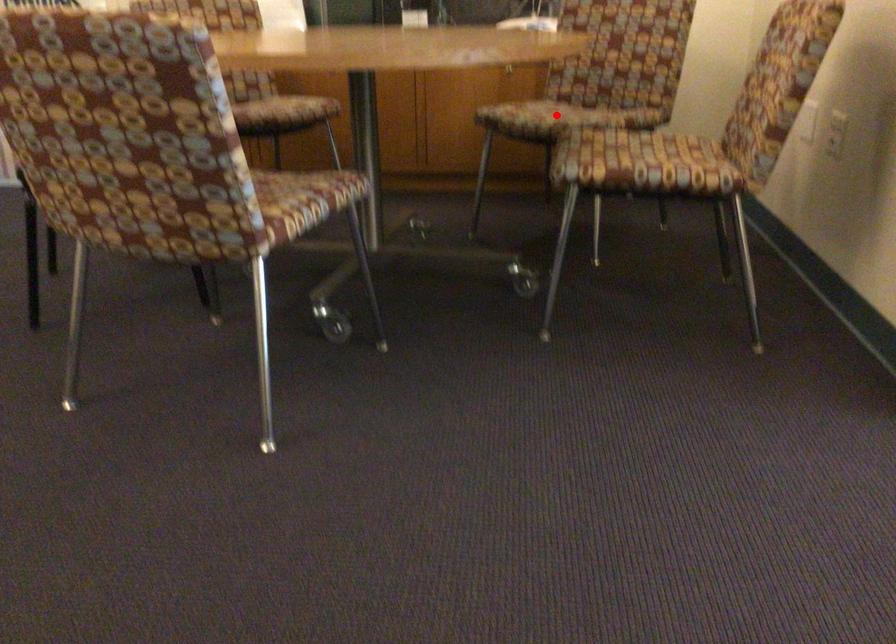
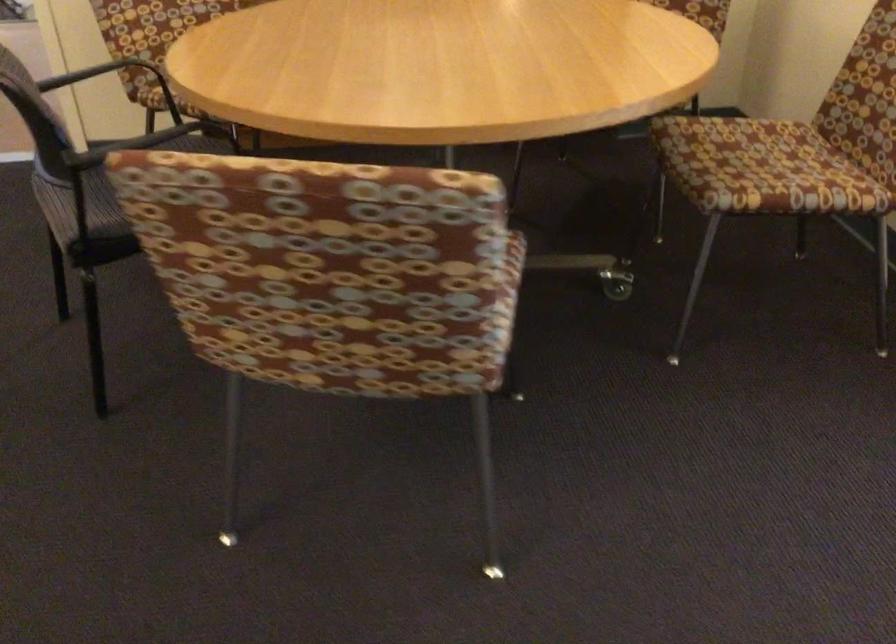
Question: I am providing you with two images of the same scene from different viewpoints. A red point is marked on the first image. Is the red point's position out of view in image 2?

Choices:
 (A) Yes
 (B) No

Answer: (A)